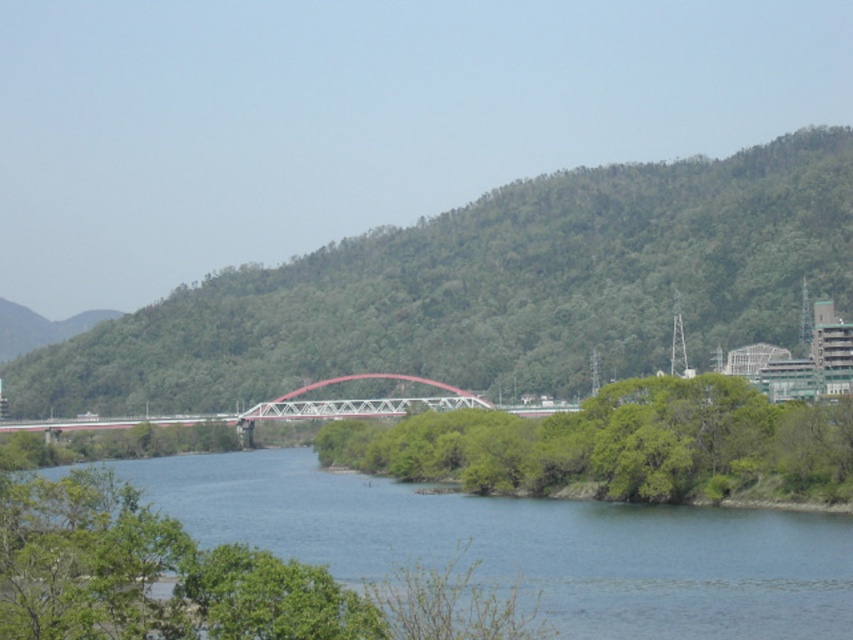
Who is positioned more to the left, green leafy hill at center or blue water at center?

green leafy hill at center is more to the left.

Can you confirm if green leafy hill at center is taller than blue water at center?

Yes, green leafy hill at center is taller than blue water at center.

Identify the location of green leafy hill at center. This screenshot has height=640, width=853. (492, 289).

Between green leafy hill at center and metallic red bridge at center, which one has less height?

metallic red bridge at center

Is point (421, 349) in front of point (498, 404)?

No, (421, 349) is further to viewer.

Is point (405, 294) positioned behind point (340, 406)?

That is True.

You are a GUI agent. You are given a task and a screenshot of the screen. Output one action in this format:
    pyautogui.click(x=<x>, y=<y>)
    Task: Click on the green leafy hill at center
    Image resolution: width=853 pixels, height=640 pixels.
    Given the screenshot: What is the action you would take?
    pyautogui.click(x=492, y=289)

Does blue water at center appear over metallic red bridge at center?

Actually, blue water at center is below metallic red bridge at center.

Which is behind, point (177, 474) or point (88, 419)?

Point (88, 419)

Find the location of a particular element. The height and width of the screenshot is (640, 853). blue water at center is located at coordinates (532, 547).